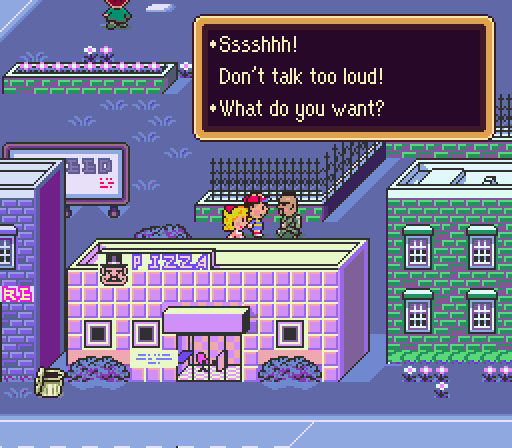
In order to click on trashcan in this screenshot , I will do click(x=52, y=390).